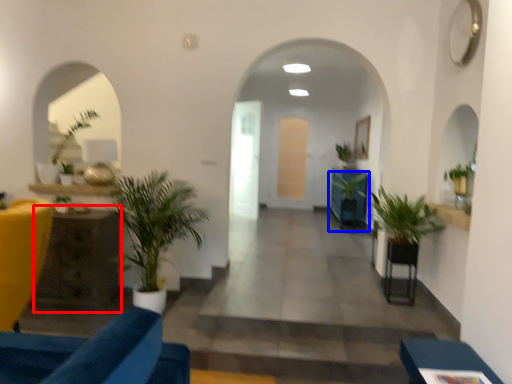
Question: Which object appears closest to the camera in this image, table (highlighted by a red box) or houseplant (highlighted by a blue box)?

Choices:
 (A) table
 (B) houseplant

Answer: (A)